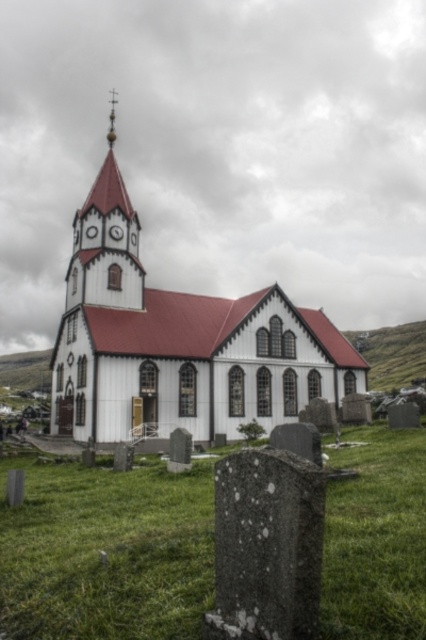
Can you confirm if green stone gravestone at lower center is smaller than smooth red spire at upper center?

Correct, green stone gravestone at lower center occupies less space than smooth red spire at upper center.

Does green stone gravestone at lower center have a lesser height compared to smooth red spire at upper center?

Indeed, green stone gravestone at lower center has a lesser height compared to smooth red spire at upper center.

Between point (129, 570) and point (114, 93), which one is positioned in front?

Point (129, 570) is in front.

Locate an element on the screen. green stone gravestone at lower center is located at coordinates (106, 552).

Who is positioned more to the left, green stone gravestone at lower center or white wood church at center?

From the viewer's perspective, green stone gravestone at lower center appears more on the left side.

Can you confirm if green stone gravestone at lower center is thinner than white wood church at center?

Indeed, green stone gravestone at lower center has a lesser width compared to white wood church at center.

Consider the image. Measure the distance between point (22, 604) and camera.

A distance of 30.40 meters exists between point (22, 604) and camera.

Image resolution: width=426 pixels, height=640 pixels. Identify the location of green stone gravestone at lower center. (106, 552).

Which is in front, point (258, 465) or point (112, 90)?

Positioned in front is point (258, 465).

Can you confirm if granite gravestone at lower center is smaller than smooth red spire at upper center?

Correct, granite gravestone at lower center occupies less space than smooth red spire at upper center.

The width and height of the screenshot is (426, 640). In order to click on granite gravestone at lower center in this screenshot , I will do `click(267, 545)`.

Locate an element on the screen. The image size is (426, 640). granite gravestone at lower center is located at coordinates (267, 545).